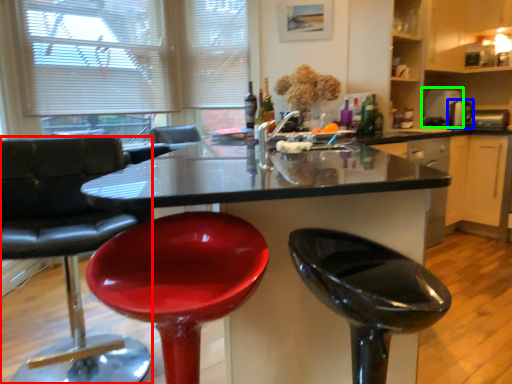
Question: Based on their relative distances, which object is nearer to chair (highlighted by a red box)? Choose from appliance (highlighted by a blue box) and appliance (highlighted by a green box).

Choices:
 (A) appliance
 (B) appliance

Answer: (B)